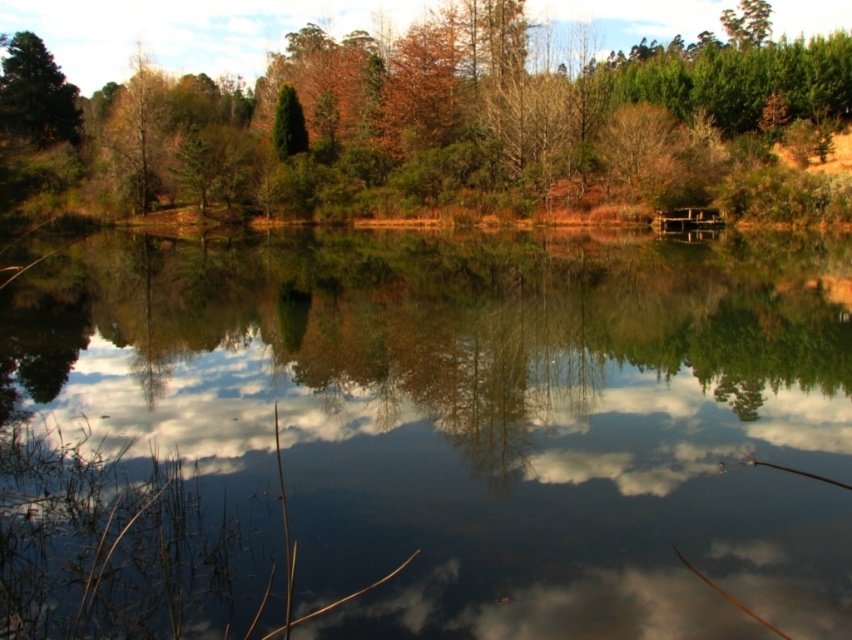
In the scene shown: Is transparent water at center taller than green matte tree at center?

No.

Is transparent water at center to the left of green matte tree at center from the viewer's perspective?

No, transparent water at center is not to the left of green matte tree at center.

The height and width of the screenshot is (640, 852). I want to click on transparent water at center, so click(x=476, y=419).

Looking at this image, is the position of transparent water at center more distant than that of green matte tree at upper left?

No.

Does point (354, 237) come in front of point (39, 129)?

That is True.

Between point (400, 241) and point (27, 108), which one is positioned behind?

The point (27, 108) is behind.

This screenshot has height=640, width=852. In order to click on transparent water at center in this screenshot , I will do `click(476, 419)`.

Is the position of green matte tree at center more distant than that of green matte tree at upper left?

No, it is not.

Between green matte tree at center and green matte tree at upper left, which one has less height?

green matte tree at upper left is shorter.

Describe the element at coordinates (482, 115) in the screenshot. This screenshot has width=852, height=640. I see `green matte tree at center` at that location.

Where is `green matte tree at center`? The width and height of the screenshot is (852, 640). green matte tree at center is located at coordinates (482, 115).